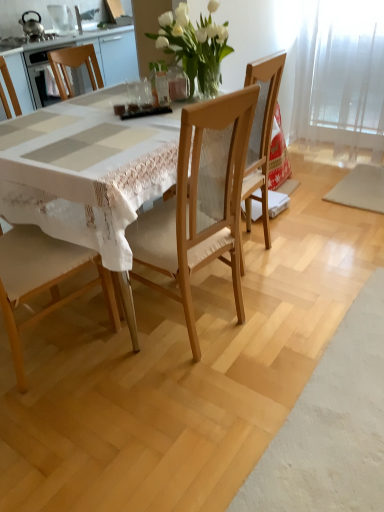
This screenshot has height=512, width=384. I want to click on vacant space behind clear glass at center, so click(x=132, y=92).